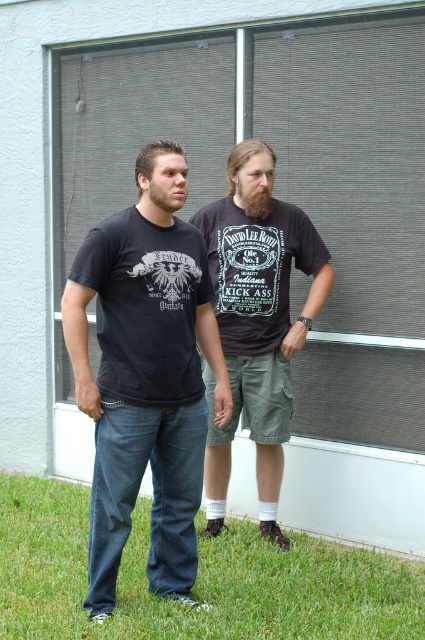
Can you confirm if dark gray cotton t-shirt at center is taller than brown fuzzy beard at center?

Correct, dark gray cotton t-shirt at center is much taller as brown fuzzy beard at center.

Is dark gray cotton t-shirt at center closer to the viewer compared to brown fuzzy beard at center?

No, it is behind brown fuzzy beard at center.

Find the location of a particular element. dark gray cotton t-shirt at center is located at coordinates (257, 326).

Between gray mesh screen door at center and dark gray cotton t-shirt at center, which one is positioned higher?

gray mesh screen door at center is higher up.

Locate an element on the screen. The height and width of the screenshot is (640, 425). gray mesh screen door at center is located at coordinates (280, 179).

Between gray mesh screen door at center and green grass at lower center, which one has more height?

Standing taller between the two is gray mesh screen door at center.

Is gray mesh screen door at center to the right of green grass at lower center from the viewer's perspective?

Indeed, gray mesh screen door at center is positioned on the right side of green grass at lower center.

Where is `gray mesh screen door at center`? This screenshot has width=425, height=640. gray mesh screen door at center is located at coordinates (280, 179).